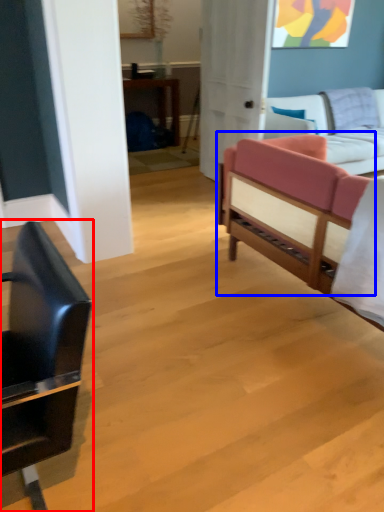
Question: Which object appears closest to the camera in this image, chair (highlighted by a red box) or studio couch (highlighted by a blue box)?

Choices:
 (A) chair
 (B) studio couch

Answer: (A)